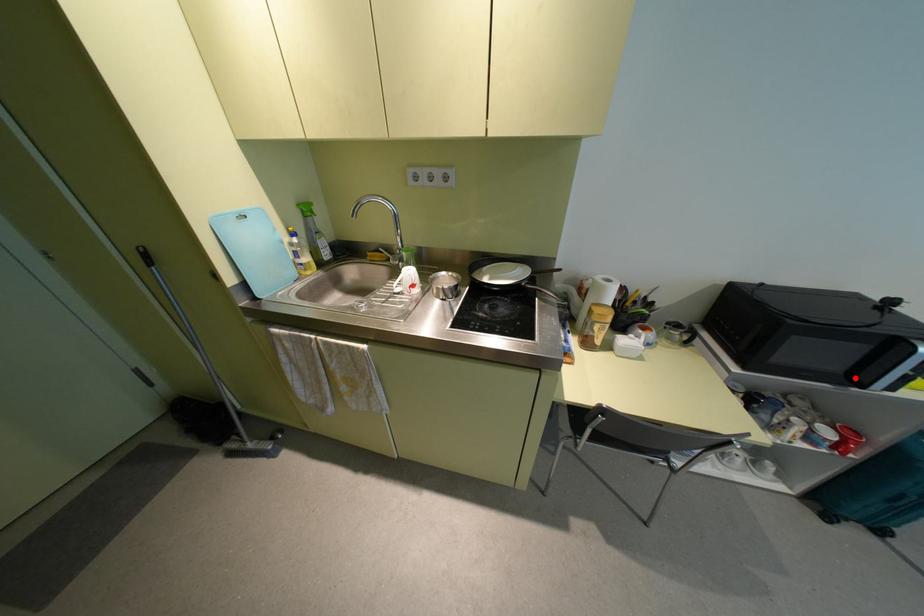
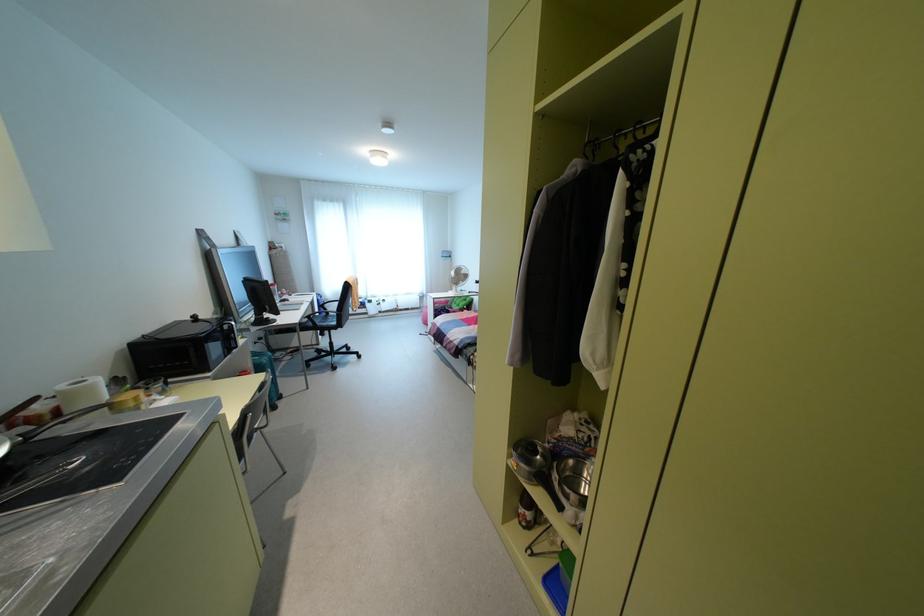
In the second image, find the point that corresponds to the highlighted location in the first image.

(229, 346)